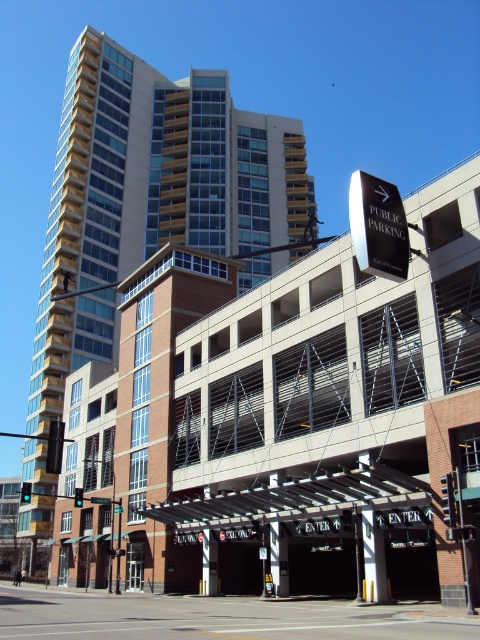
Which is in front, point (363, 502) or point (142, 220)?

Point (363, 502)

From the picture: Between concrete parking garage at center and beige glass building at center, which one appears on the left side from the viewer's perspective?

Positioned to the left is beige glass building at center.

This screenshot has height=640, width=480. Identify the location of concrete parking garage at center. (335, 417).